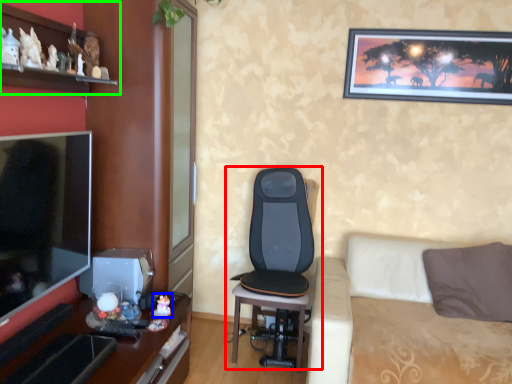
Question: Which is nearer to the chair (highlighted by a red box)? toy (highlighted by a blue box) or shelf (highlighted by a green box).

Choices:
 (A) toy
 (B) shelf

Answer: (A)